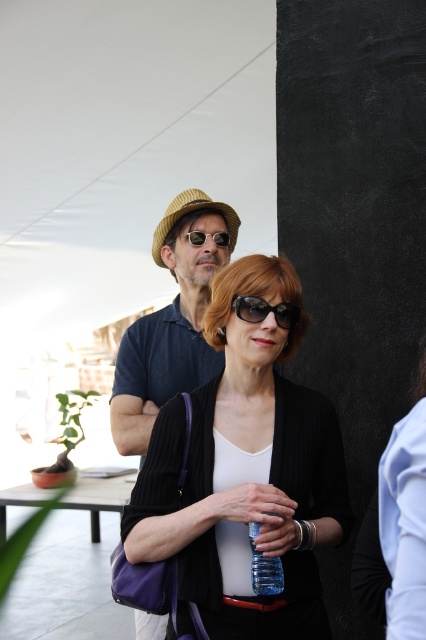
You are a photographer at the scene and want to capture a closeup of the blue plastic bottle at center without the sunglasses at center overlapping it. Given their sizes, is this feasible?

The blue plastic bottle at center is narrower than the sunglasses at center, so positioning the camera to avoid overlap might be challenging due to the bottle being smaller in width. However, adjusting the angle or distance could help isolate the bottle without the sunglasses obstructing it.

You are a photographer adjusting camera settings. You notice the blue plastic bottle at center and the sunglasses at center in your frame. Which object is taller?

The blue plastic bottle at center is taller than the sunglasses at center.